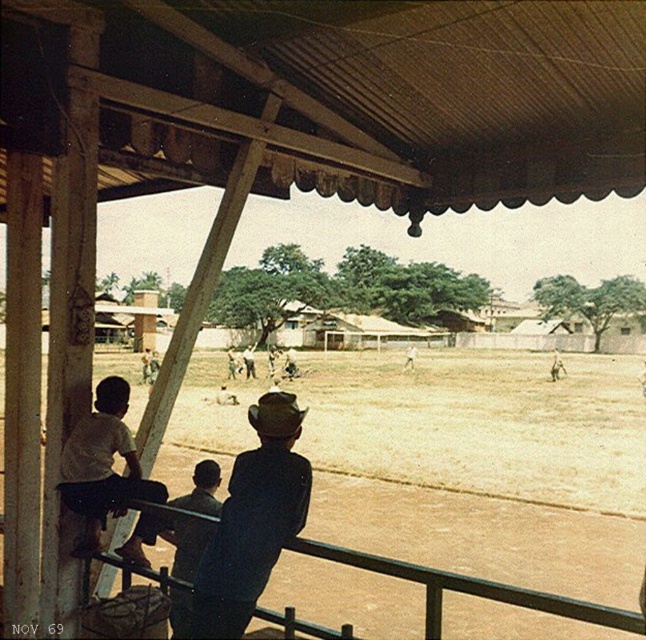
The image size is (646, 640). Describe the element at coordinates (101, 465) in the screenshot. I see `white matte shirt at left` at that location.

Between white matte shirt at left and dark blue shirt at center, which one is positioned lower?

Positioned lower is dark blue shirt at center.

Image resolution: width=646 pixels, height=640 pixels. What are the coordinates of `white matte shirt at left` in the screenshot? It's located at (101, 465).

Is brown sandy ground at center thinner than dark blue denim jacket at center?

In fact, brown sandy ground at center might be wider than dark blue denim jacket at center.

This screenshot has width=646, height=640. Describe the element at coordinates (483, 424) in the screenshot. I see `brown sandy ground at center` at that location.

Find the location of a particular element. The height and width of the screenshot is (640, 646). brown sandy ground at center is located at coordinates (483, 424).

Is brown corrugated metal at upper center below dark blue shirt at center?

Incorrect, brown corrugated metal at upper center is not positioned below dark blue shirt at center.

Is brown corrugated metal at upper center to the right of dark blue shirt at center from the viewer's perspective?

Yes, brown corrugated metal at upper center is to the right of dark blue shirt at center.

You are a GUI agent. You are given a task and a screenshot of the screen. Output one action in this format:
    pyautogui.click(x=<x>, y=<y>)
    Task: Click on the brown corrugated metal at upper center
    
    Given the screenshot: What is the action you would take?
    pyautogui.click(x=348, y=96)

Locate an element on the screen. The image size is (646, 640). brown corrugated metal at upper center is located at coordinates click(348, 96).